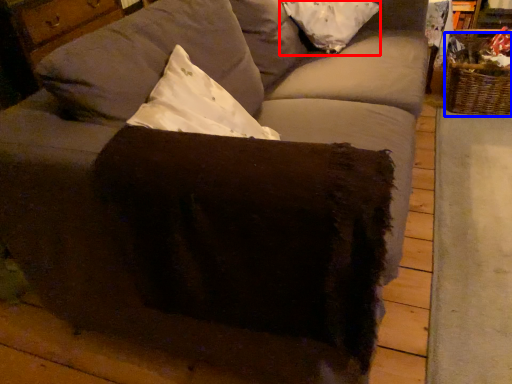
Question: Which of the following is the farthest to the observer, pillow (highlighted by a red box) or basket (highlighted by a blue box)?

Choices:
 (A) pillow
 (B) basket

Answer: (B)